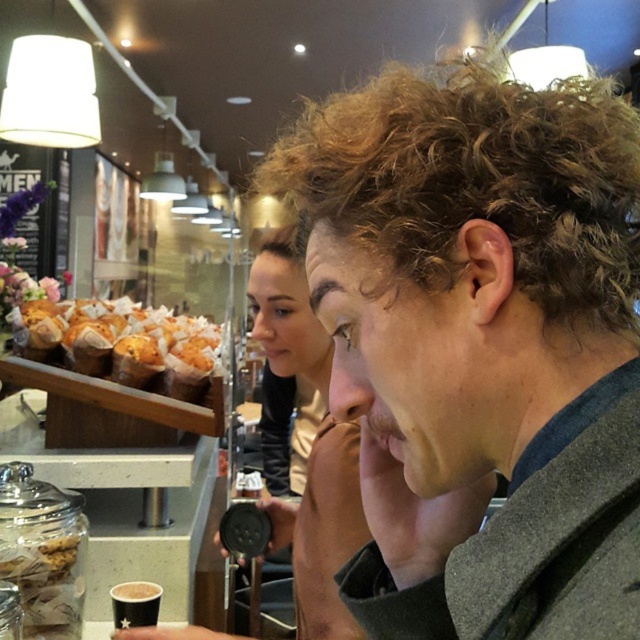
Which is more to the right, golden-brown muffin at left or matte black hair at center?

matte black hair at center is more to the right.

Which is behind, point (200, 371) or point (292, 282)?

The point (200, 371) is more distant.

I want to click on golden-brown muffin at left, so click(x=122, y=342).

Does matte black hair at center appear on the right side of brown curly hair at upper center?

In fact, matte black hair at center is to the left of brown curly hair at upper center.

Can you confirm if matte black hair at center is positioned above brown curly hair at upper center?

→ No.

Locate an element on the screen. This screenshot has width=640, height=640. matte black hair at center is located at coordinates (291, 340).

This screenshot has width=640, height=640. Identify the location of matte black hair at center. [x=291, y=340].

Can you confirm if golden-brown muffin at left is positioned to the left of brown curly hair at upper center?

Indeed, golden-brown muffin at left is positioned on the left side of brown curly hair at upper center.

Consider the image. Does golden-brown muffin at left lie in front of brown curly hair at upper center?

No.

Is point (116, 352) closer to viewer compared to point (285, 259)?

No.

This screenshot has width=640, height=640. In order to click on golden-brown muffin at left in this screenshot , I will do `click(122, 342)`.